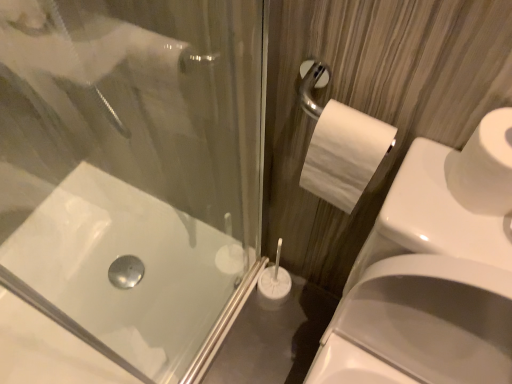
Question: Is white glossy bath at lower left completely or partially inside white matte toilet paper at right, which is counted as the 1th toilet paper, starting from the left?

Choices:
 (A) yes
 (B) no

Answer: (B)

Question: Is white matte toilet paper at right, which is counted as the 1th toilet paper, starting from the left, at the right side of white glossy bath at lower left?

Choices:
 (A) no
 (B) yes

Answer: (B)

Question: Is white matte toilet paper at right, which is counted as the 1th toilet paper, starting from the left, to the left of white glossy bath at lower left from the viewer's perspective?

Choices:
 (A) no
 (B) yes

Answer: (A)

Question: Is white matte toilet paper at right, which is counted as the 2th toilet paper, starting from the right, far away from white glossy bath at lower left?

Choices:
 (A) no
 (B) yes

Answer: (A)

Question: Does white matte toilet paper at right, which is counted as the 2th toilet paper, starting from the right, have a greater height compared to white glossy bath at lower left?

Choices:
 (A) yes
 (B) no

Answer: (A)

Question: From the image's perspective, relative to white matte toilet paper at right, the 1th toilet paper in the right-to-left sequence, is white glossy sink at lower right above or below?

Choices:
 (A) below
 (B) above

Answer: (A)

Question: In terms of size, does white glossy sink at lower right appear bigger or smaller than white matte toilet paper at right, the 2th toilet paper positioned from the left?

Choices:
 (A) big
 (B) small

Answer: (A)

Question: From a real-world perspective, is white glossy sink at lower right positioned above or below white matte toilet paper at right, the 2th toilet paper positioned from the left?

Choices:
 (A) above
 (B) below

Answer: (B)

Question: In terms of width, does white glossy sink at lower right look wider or thinner when compared to white matte toilet paper at right, the 2th toilet paper positioned from the left?

Choices:
 (A) wide
 (B) thin

Answer: (A)

Question: Is white matte toilet paper at right, which is counted as the 2th toilet paper, starting from the right, to the left or to the right of white matte toilet paper at right, the 1th toilet paper in the right-to-left sequence, in the image?

Choices:
 (A) left
 (B) right

Answer: (A)

Question: From the image's perspective, relative to white matte toilet paper at right, the 2th toilet paper positioned from the left, is white matte toilet paper at right, which is counted as the 1th toilet paper, starting from the left, above or below?

Choices:
 (A) below
 (B) above

Answer: (B)

Question: Is white matte toilet paper at right, which is counted as the 2th toilet paper, starting from the right, spatially inside white matte toilet paper at right, the 1th toilet paper in the right-to-left sequence, or outside of it?

Choices:
 (A) inside
 (B) outside

Answer: (B)

Question: Is white matte toilet paper at right, which is counted as the 2th toilet paper, starting from the right, wider or thinner than white matte toilet paper at right, the 1th toilet paper in the right-to-left sequence?

Choices:
 (A) thin
 (B) wide

Answer: (A)

Question: Would you say white matte toilet paper at right, the 1th toilet paper in the right-to-left sequence, is to the left or to the right of white matte toilet paper at right, which is counted as the 2th toilet paper, starting from the right, in the picture?

Choices:
 (A) left
 (B) right

Answer: (B)

Question: Is point (464, 201) positioned closer to the camera than point (332, 163)?

Choices:
 (A) farther
 (B) closer

Answer: (B)